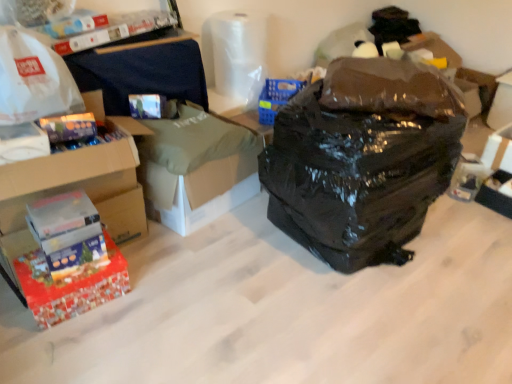
Identify the location of vacant space to the left of black plastic storage box at lower right, which ranks as the 3th storage box in top-to-bottom order. This screenshot has height=384, width=512. (466, 210).